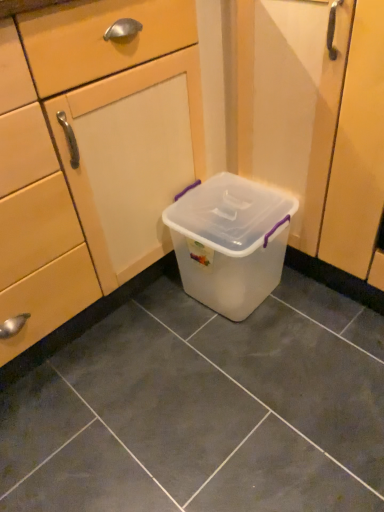
You are a GUI agent. You are given a task and a screenshot of the screen. Output one action in this format:
    pyautogui.click(x=<x>, y=<y>)
    Task: Click on the free spot to the left of transparent plastic storage box at center
    This screenshot has width=384, height=512.
    Given the screenshot: What is the action you would take?
    pyautogui.click(x=145, y=320)